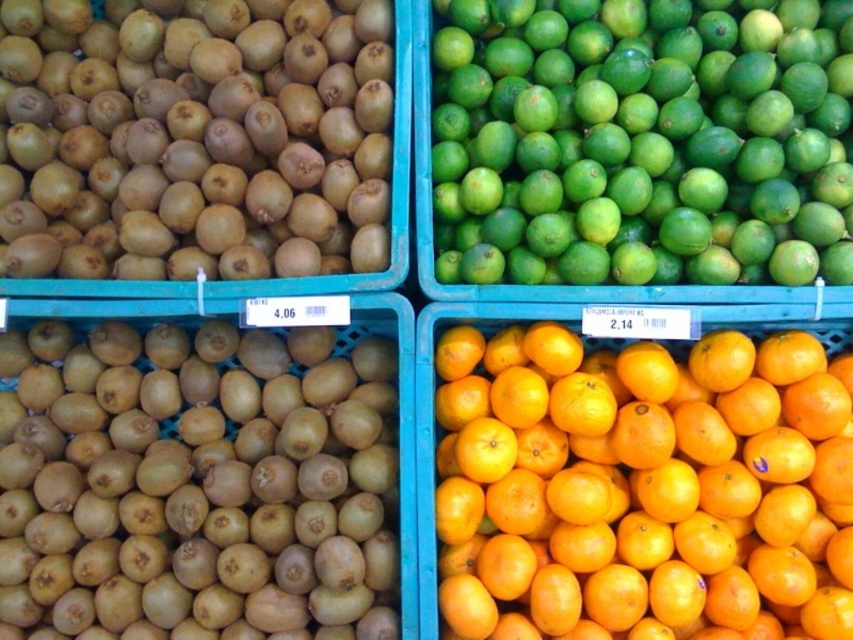
Consider the image. Between green matte lime at upper right and brown matte kiwi at upper left, which one appears on the left side from the viewer's perspective?

brown matte kiwi at upper left

Is green matte lime at upper right smaller than brown matte kiwi at upper left?

Indeed, green matte lime at upper right has a smaller size compared to brown matte kiwi at upper left.

Between point (831, 147) and point (158, 212), which one is positioned behind?

Positioned behind is point (831, 147).

Identify the location of green matte lime at upper right. (639, 144).

Does point (590, 532) come farther from viewer compared to point (682, 198)?

No, it is not.

Who is positioned more to the left, orange matte/orange at center or green matte lime at upper right?

Positioned to the left is orange matte/orange at center.

Is point (474, 465) positioned in front of point (457, 120)?

Yes, it is.

The image size is (853, 640). What are the coordinates of `orange matte/orange at center` in the screenshot? It's located at (642, 484).

Which is in front, point (746, 611) or point (73, 205)?

Point (746, 611)

The width and height of the screenshot is (853, 640). What are the coordinates of `orange matte/orange at center` in the screenshot? It's located at (642, 484).

Where is `orange matte/orange at center`? Image resolution: width=853 pixels, height=640 pixels. orange matte/orange at center is located at coordinates (642, 484).